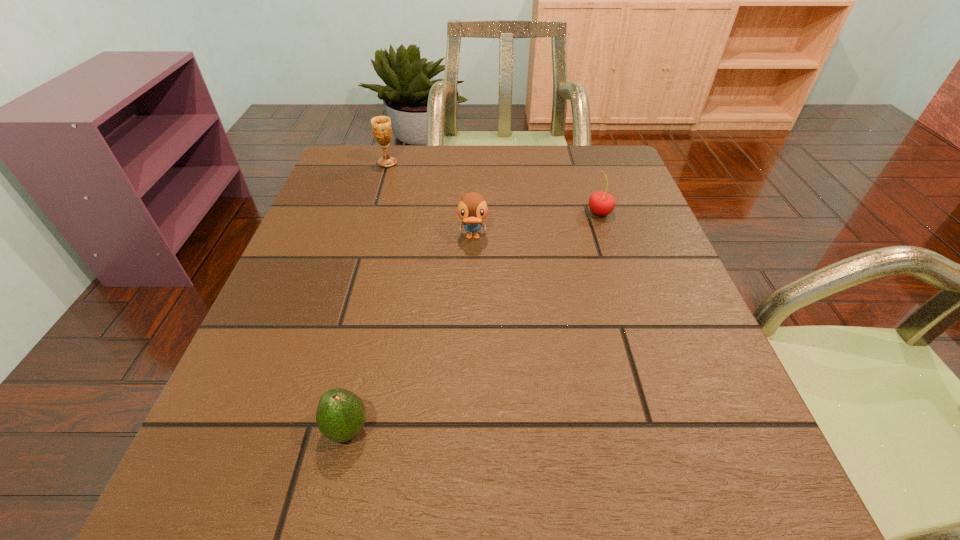
The height and width of the screenshot is (540, 960). In order to click on free space that is in between the nearest object and the rightmost object in this screenshot , I will do `click(473, 321)`.

Identify the location of vacant point located between the third object from left to right and the farthest object. coord(430,200).

Locate an element on the screen. This screenshot has height=540, width=960. unoccupied position between the third object from left to right and the farthest object is located at coordinates (430, 200).

Where is `empty space between the nearest object and the third object from left to right`? Image resolution: width=960 pixels, height=540 pixels. empty space between the nearest object and the third object from left to right is located at coordinates (410, 333).

Locate an element on the screen. The image size is (960, 540). vacant space in between the cherry and the third farthest object is located at coordinates (537, 225).

I want to click on vacant space that's between the third object from left to right and the third nearest object, so click(x=537, y=225).

The height and width of the screenshot is (540, 960). In order to click on free space between the third nearest object and the chalice in this screenshot , I will do `click(493, 188)`.

Where is `vacant region between the nearest object and the chalice`? This screenshot has height=540, width=960. vacant region between the nearest object and the chalice is located at coordinates (368, 296).

At what (x,y) coordinates should I click in order to perform the action: click on vacant area that lies between the third nearest object and the third object from left to right. Please return your answer as a coordinate pair (x, y). The height and width of the screenshot is (540, 960). Looking at the image, I should click on (537, 225).

The height and width of the screenshot is (540, 960). Find the location of `object that ranks as the closest to the third nearest object`. object that ranks as the closest to the third nearest object is located at coordinates click(472, 208).